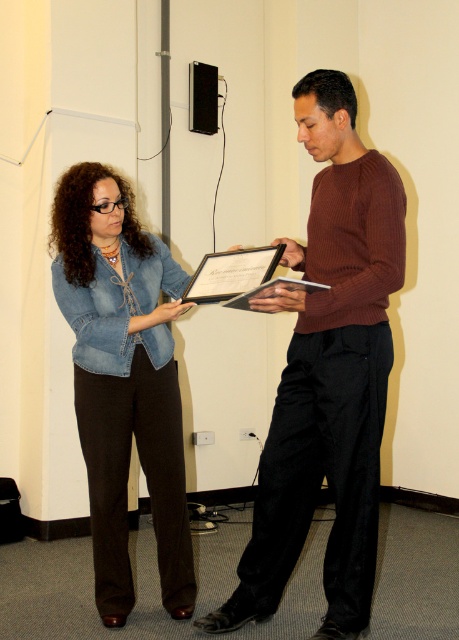
Who is more distant from viewer, (359,579) or (100,502)?

Point (100,502)

Is point (345, 145) positioned in front of point (72, 280)?

Yes, point (345, 145) is in front of point (72, 280).

You are a GUI agent. You are given a task and a screenshot of the screen. Output one action in this format:
    pyautogui.click(x=<x>, y=<y>)
    Task: Click on the brown ribbed sweater at center
    
    Given the screenshot: What is the action you would take?
    (328, 372)